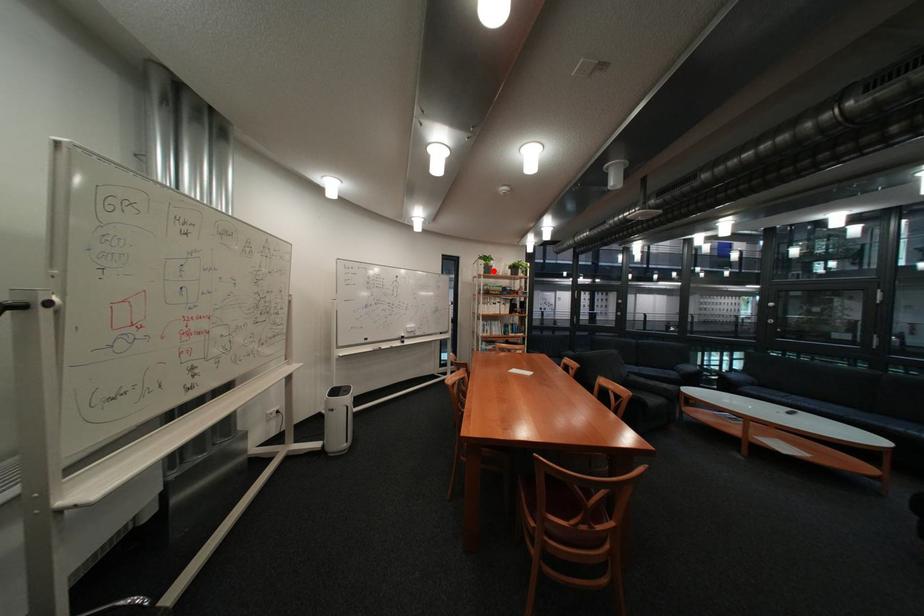
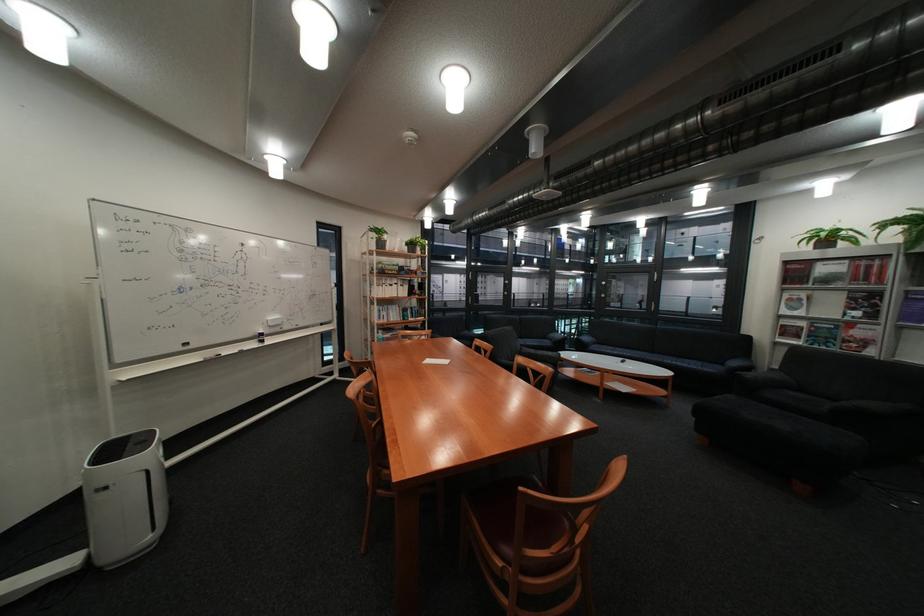
The point at the highlighted location is marked in the first image. Where is the corresponding point in the second image?

(383, 246)